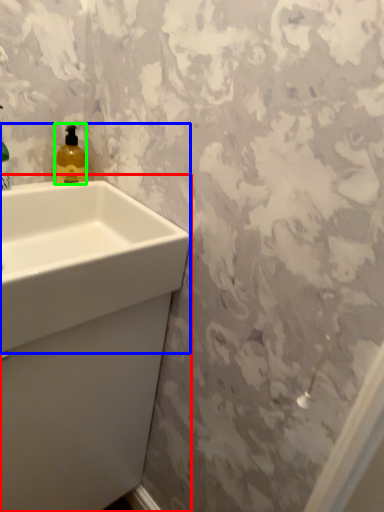
Question: Which object is the farthest from sink (highlighted by a red box)? Choose among these: sink (highlighted by a blue box) or soap dispenser (highlighted by a green box).

Choices:
 (A) sink
 (B) soap dispenser

Answer: (B)